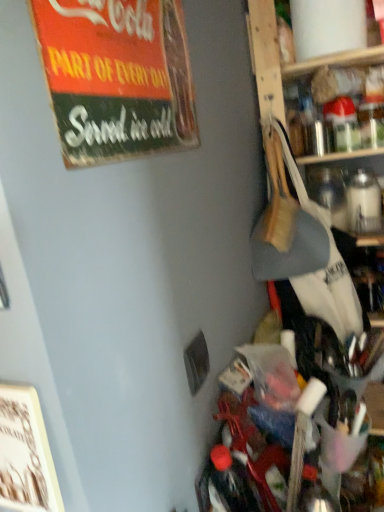
Question: Which is correct: vintage cardboard sign at upper left is inside clear glass bottle at upper right, or outside of it?

Choices:
 (A) outside
 (B) inside

Answer: (A)

Question: From a real-world perspective, is vintage cardboard sign at upper left physically located above or below clear glass bottle at upper right?

Choices:
 (A) below
 (B) above

Answer: (B)

Question: Would you say vintage cardboard sign at upper left is to the left or to the right of clear glass bottle at upper right in the picture?

Choices:
 (A) left
 (B) right

Answer: (A)

Question: From a real-world perspective, relative to vintage cardboard sign at upper left, is clear glass bottle at upper right vertically above or below?

Choices:
 (A) above
 (B) below

Answer: (B)

Question: Is point (339, 117) positioned closer to the camera than point (54, 105)?

Choices:
 (A) farther
 (B) closer

Answer: (A)

Question: Do you think clear glass bottle at upper right is within vintage cardboard sign at upper left, or outside of it?

Choices:
 (A) inside
 (B) outside

Answer: (B)

Question: Considering their positions, is clear glass bottle at upper right located in front of or behind vintage cardboard sign at upper left?

Choices:
 (A) behind
 (B) front

Answer: (A)